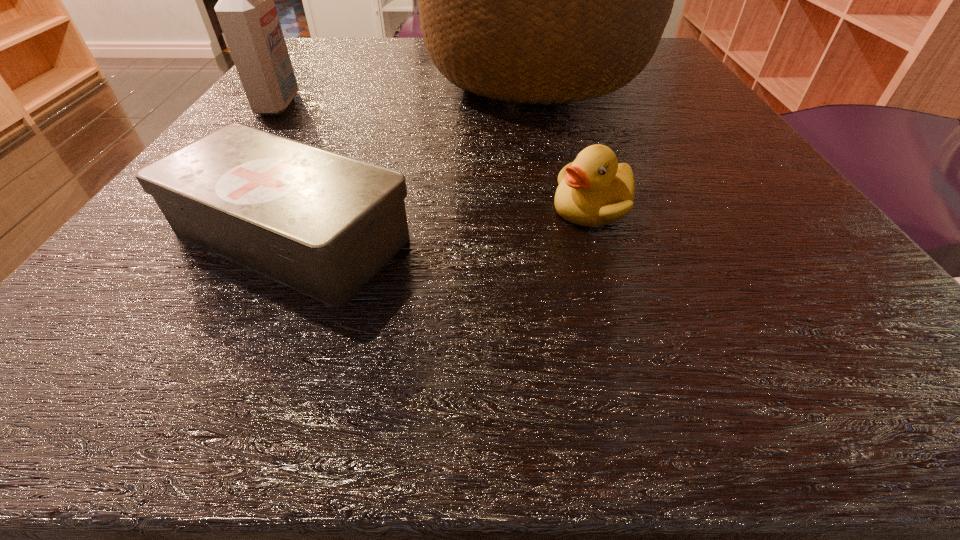
This screenshot has width=960, height=540. In order to click on object located at the far edge in this screenshot , I will do `click(545, 0)`.

The width and height of the screenshot is (960, 540). Identify the location of cleansing agent located in the left edge section of the desktop. (247, 14).

Where is `the first-aid kit located at the left edge`? the first-aid kit located at the left edge is located at coordinates (324, 224).

The width and height of the screenshot is (960, 540). I want to click on object that is at the right edge, so click(545, 0).

Where is `object that is at the far right corner`? This screenshot has width=960, height=540. object that is at the far right corner is located at coordinates (545, 0).

Image resolution: width=960 pixels, height=540 pixels. In the image, there is a desktop. What are the coordinates of `vacant space at the far edge` in the screenshot? It's located at (425, 49).

Where is `blank area at the near edge`? The height and width of the screenshot is (540, 960). blank area at the near edge is located at coordinates (236, 339).

Image resolution: width=960 pixels, height=540 pixels. I want to click on vacant region at the left edge of the desktop, so click(x=312, y=109).

Locate an element on the screen. free region at the right edge of the desktop is located at coordinates (807, 217).

This screenshot has width=960, height=540. In the image, there is a desktop. In order to click on vacant space at the far left corner in this screenshot , I will do `click(298, 58)`.